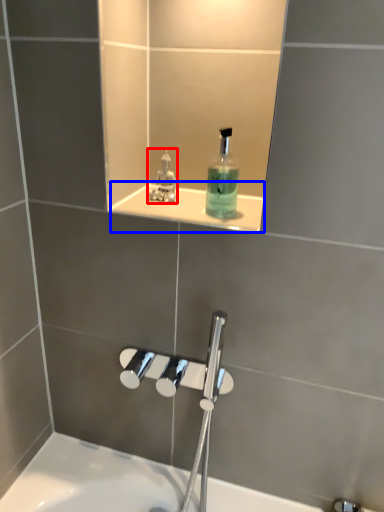
Question: Which of the following is the farthest to the observer, perfume (highlighted by a red box) or ledge (highlighted by a blue box)?

Choices:
 (A) perfume
 (B) ledge

Answer: (A)